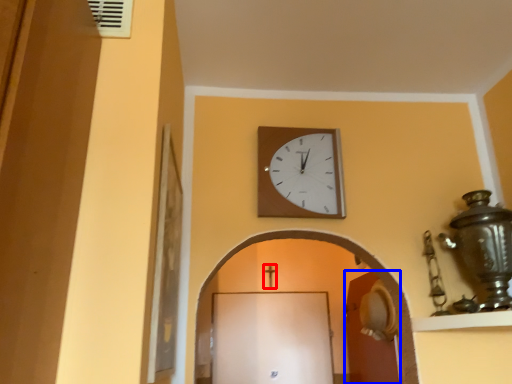
Question: Which of the following is the closest to the observer, crucifix (highlighted by a red box) or door (highlighted by a blue box)?

Choices:
 (A) crucifix
 (B) door

Answer: (B)